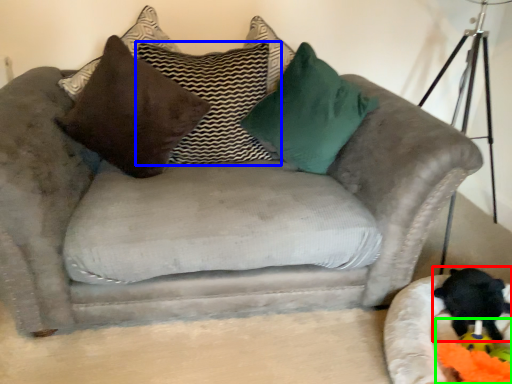
Question: Which object is positioned farthest from animal (highlighted by a red box)? Select from pillow (highlighted by a blue box) and toy (highlighted by a green box).

Choices:
 (A) pillow
 (B) toy

Answer: (A)